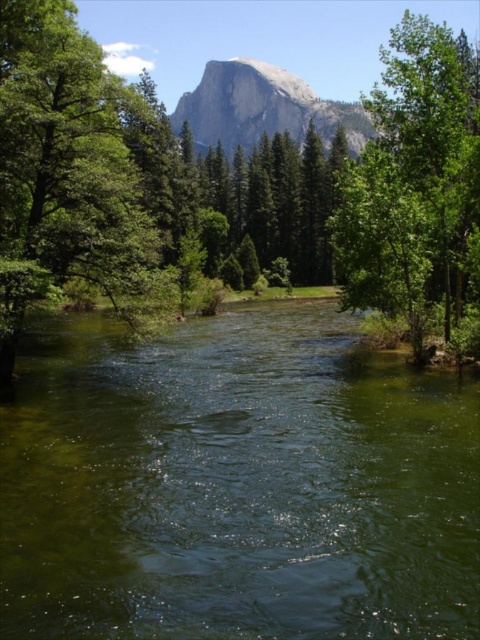
You are standing at the riverbank and want to take a photo of both point (418, 321) and point (276, 92). Which point will appear larger in your camera view?

Point (418, 321) is closer to the camera than point (276, 92), so it will appear larger in the photo.

You are standing at the point labeled as point (412, 182) in the image. Looking around, you see a green leafy tree at right. What is the nearest object to you?

The nearest object to you is the green leafy tree at right, as it is positioned closest to the point (412, 182).

You are planning to plant a new tree in the grassy area between the green leafy tree at right and the dense forested region. The new tree requires a minimum of 50 feet of space between it and any existing trees to thrive. Can you plant it in this location?

The distance between the green leafy tree at right and the dense forested region is 84.69 feet, which is more than the required 50 feet. Therefore, you can plant the new tree in the grassy area between them as there is sufficient space.